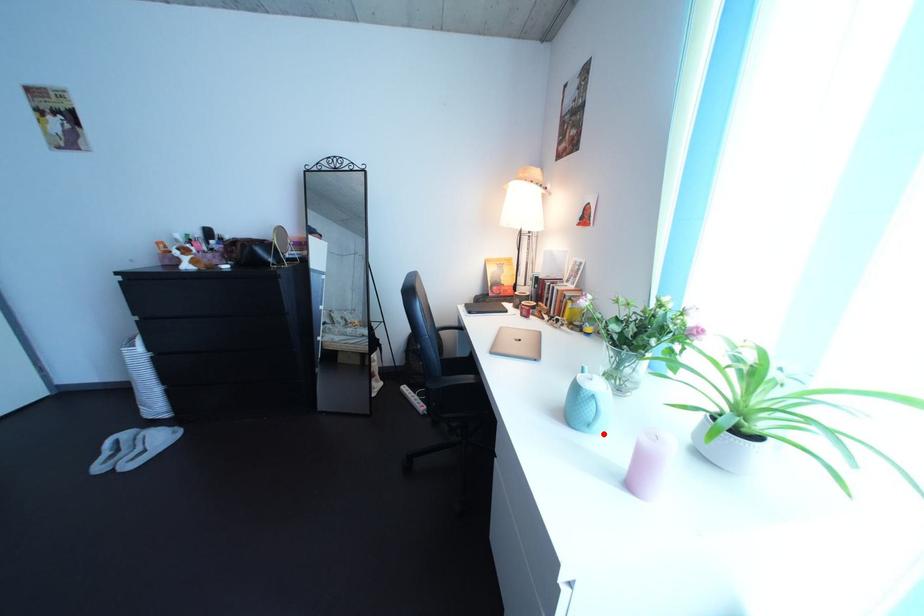
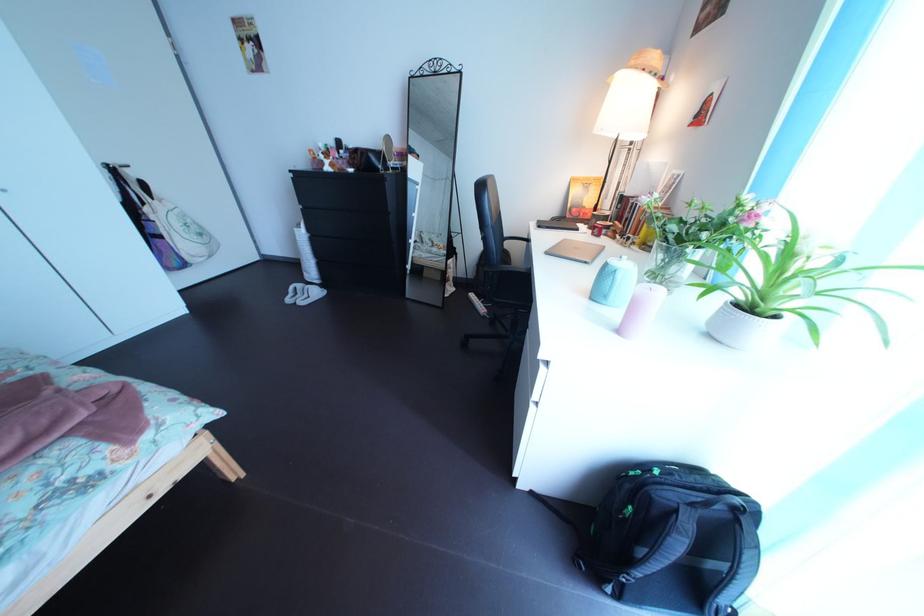
The point at the highlighted location is marked in the first image. Where is the corresponding point in the second image?

(621, 305)